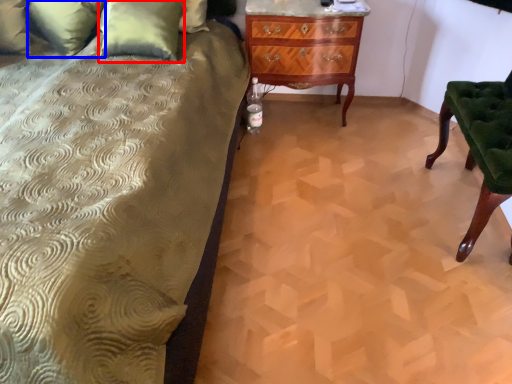
Question: Which point is closer to the camera, pillow (highlighted by a red box) or pillow (highlighted by a blue box)?

Choices:
 (A) pillow
 (B) pillow

Answer: (A)